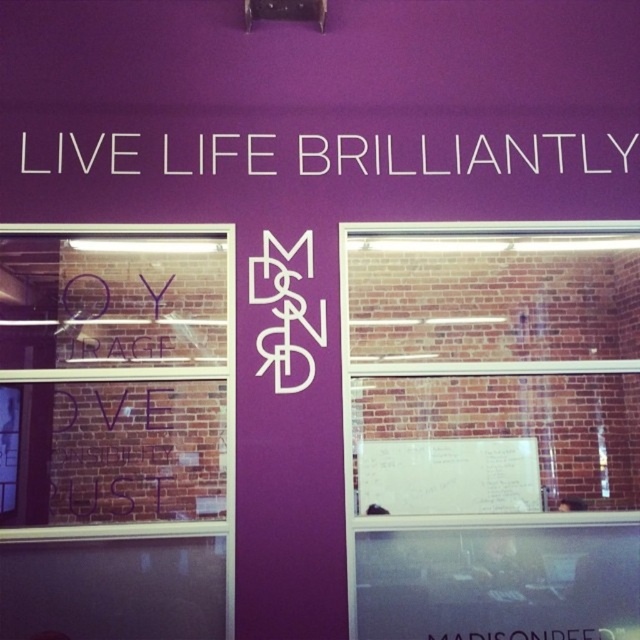
You are an architect designing a new building. You want to place a decorative element between the brick wall at center and the white text at upper center. Which one is narrower so the element can be placed closer to it?

The brick wall at center is thinner than the white text at upper center, so the decorative element should be placed closer to the brick wall at center.

You are standing in front of the building with the purple wall and want to read the white text at upper center. However, you notice that the transparent glass window at left might be blocking your view. Is the window in a position that could obstruct your ability to see the text clearly?

The transparent glass window at left is positioned under the white text at upper center, so it is below the text and would not block your view of the white text at upper center.

You are standing outside the building and want to take a photo of the white text at upper center and the brick wall at center. Based on their positions, which object should you frame first in your camera viewfinder to include both in the shot?

The white text at upper center should be framed first since the brick wall at center is to the right of it, so positioning the camera to include both would require starting with the text and then ensuring the brick wall is captured to its right.